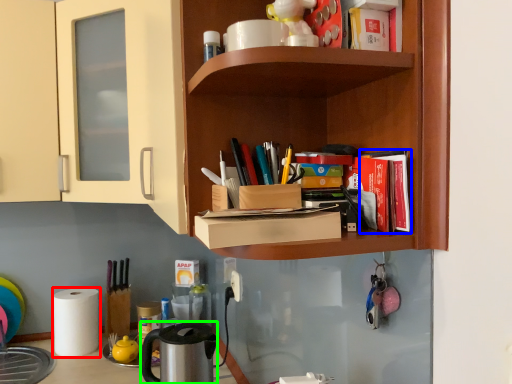
Question: Estimate the real-world distances between objects in this image. Which object is farther from paper towel (highlighted by a red box), book (highlighted by a blue box) or appliance (highlighted by a green box)?

Choices:
 (A) book
 (B) appliance

Answer: (A)